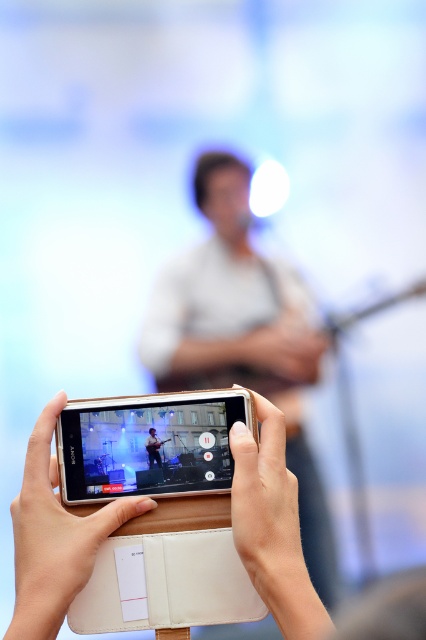
Question: Based on their relative distances, which object is farther from the white leather hand at center?

Choices:
 (A) matte white guitar at center
 (B) white matte guitar at center
 (C) white leather wallet at lower center

Answer: (B)

Question: Is the position of white matte guitar at center more distant than that of matte white guitar at center?

Choices:
 (A) yes
 (B) no

Answer: (A)

Question: Which object is closer to the camera taking this photo?

Choices:
 (A) white leather hand at center
 (B) white matte guitar at center
 (C) white leather wallet at lower center

Answer: (C)

Question: Is white matte guitar at center smaller than white leather wallet at lower center?

Choices:
 (A) yes
 (B) no

Answer: (B)

Question: Is white matte guitar at center closer to camera compared to white leather hand at center?

Choices:
 (A) yes
 (B) no

Answer: (B)

Question: Which object is the farthest from the matte white guitar at center?

Choices:
 (A) white leather wallet at lower center
 (B) white leather hand at center
 (C) white matte phone at center
 (D) white matte guitar at center

Answer: (D)